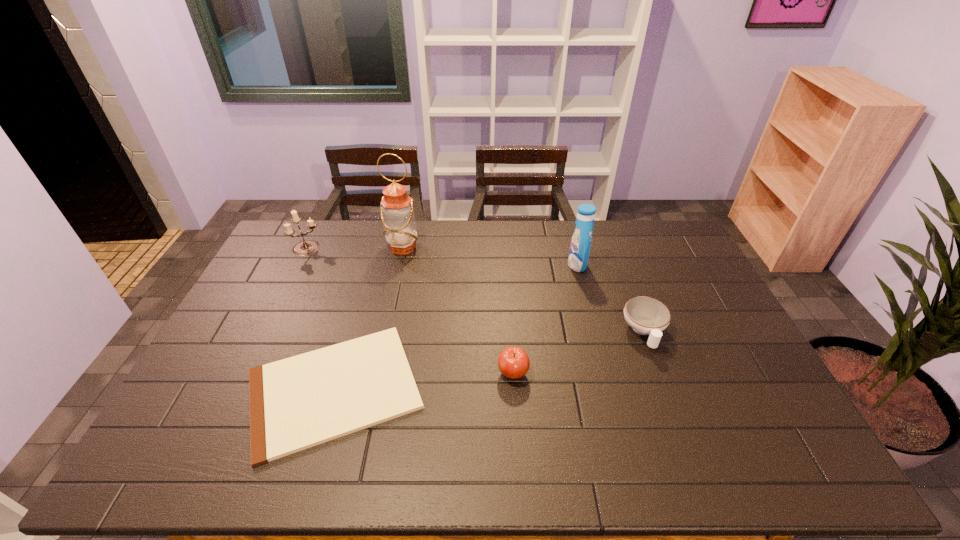
The width and height of the screenshot is (960, 540). Find the location of `blank area located 0.270m on the front-facing side of the fifth shortest object`. blank area located 0.270m on the front-facing side of the fifth shortest object is located at coordinates (492, 265).

Find the location of a particular element. The width and height of the screenshot is (960, 540). vacant region located 0.370m on the front-facing side of the fifth shortest object is located at coordinates (465, 265).

The width and height of the screenshot is (960, 540). Find the location of `vacant region located on the front-facing side of the fifth shortest object`. vacant region located on the front-facing side of the fifth shortest object is located at coordinates (470, 265).

Locate an element on the screen. This screenshot has height=540, width=960. free region located 0.190m on the front of the candle holder is located at coordinates coord(286,293).

The width and height of the screenshot is (960, 540). I want to click on free space located 0.120m on the right of the third shortest object, so click(572, 373).

Where is `vacant space located 0.110m on the side with the handle of the rightmost object`? The height and width of the screenshot is (540, 960). vacant space located 0.110m on the side with the handle of the rightmost object is located at coordinates (663, 386).

Where is `vacant space located on the right of the clipboard`? The height and width of the screenshot is (540, 960). vacant space located on the right of the clipboard is located at coordinates (576, 389).

This screenshot has height=540, width=960. Identify the location of oil lamp that is at the far edge. (397, 214).

Where is `detergent that is at the far edge`? The height and width of the screenshot is (540, 960). detergent that is at the far edge is located at coordinates (581, 240).

Find the location of a particular element. candle holder that is at the far edge is located at coordinates pos(305,247).